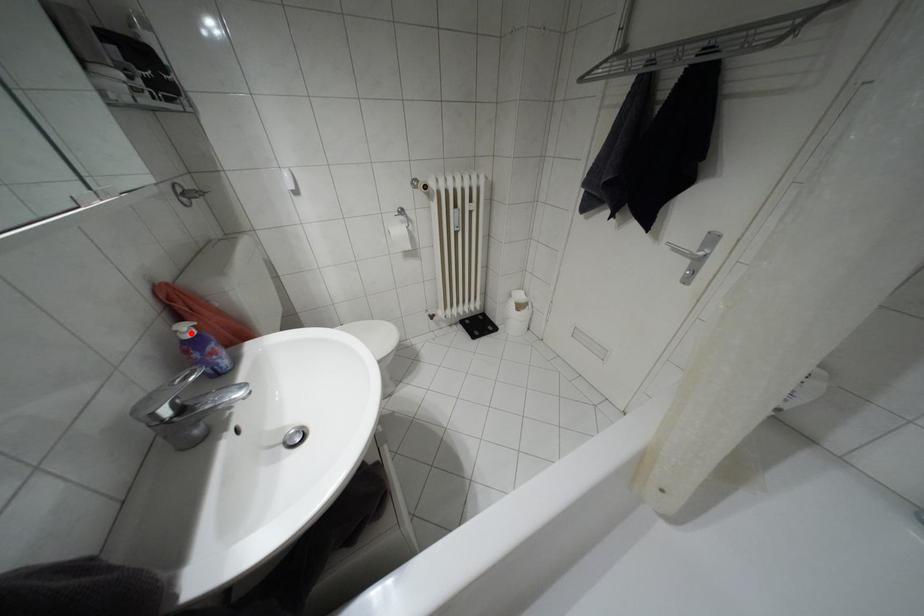
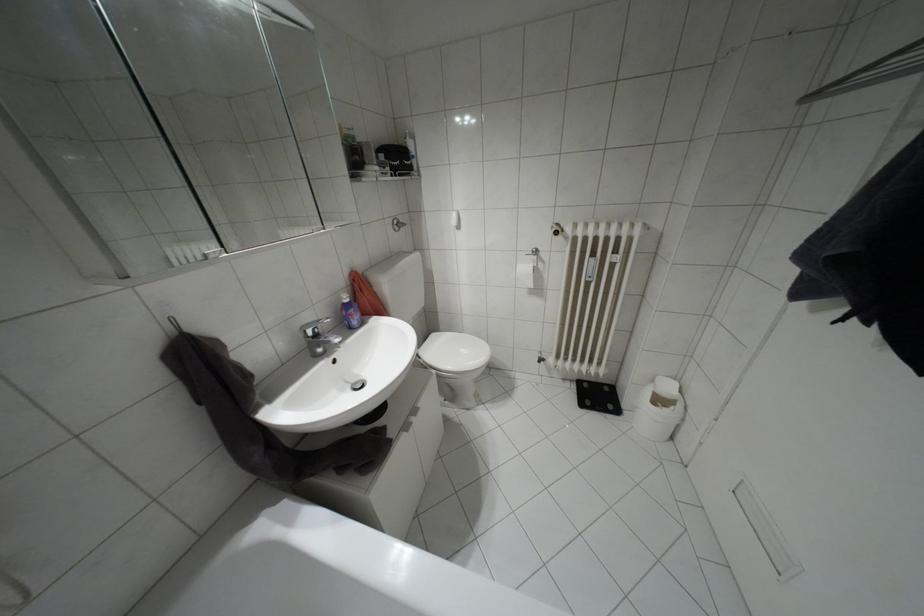
The point at the highlighted location is marked in the first image. Where is the corresponding point in the second image?

(346, 300)